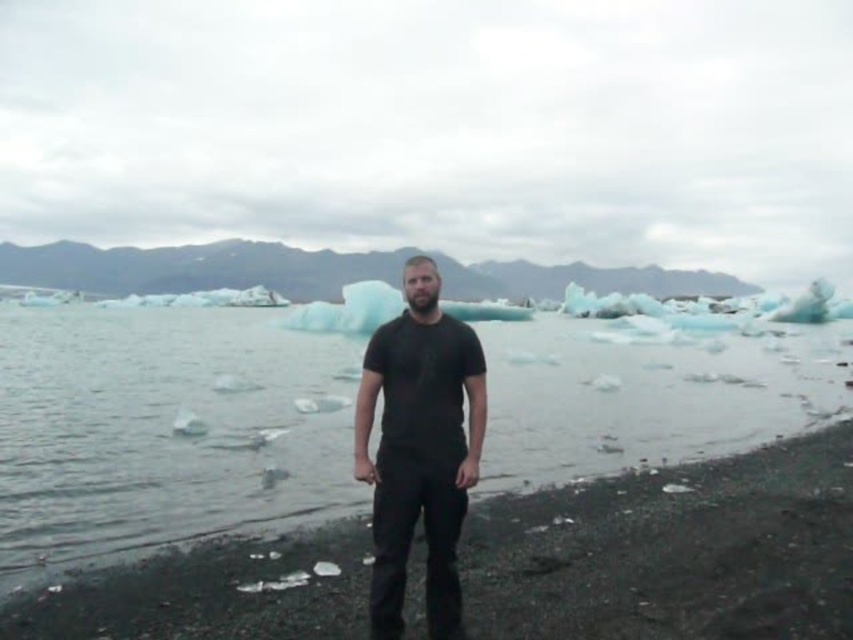
Question: Does clear ice water at center lie in front of black matte shirt at center?

Choices:
 (A) yes
 (B) no

Answer: (B)

Question: Can you confirm if clear ice water at center is positioned to the left of black matte shirt at center?

Choices:
 (A) no
 (B) yes

Answer: (B)

Question: Observing the image, what is the correct spatial positioning of clear ice water at center in reference to black matte shirt at center?

Choices:
 (A) left
 (B) right

Answer: (A)